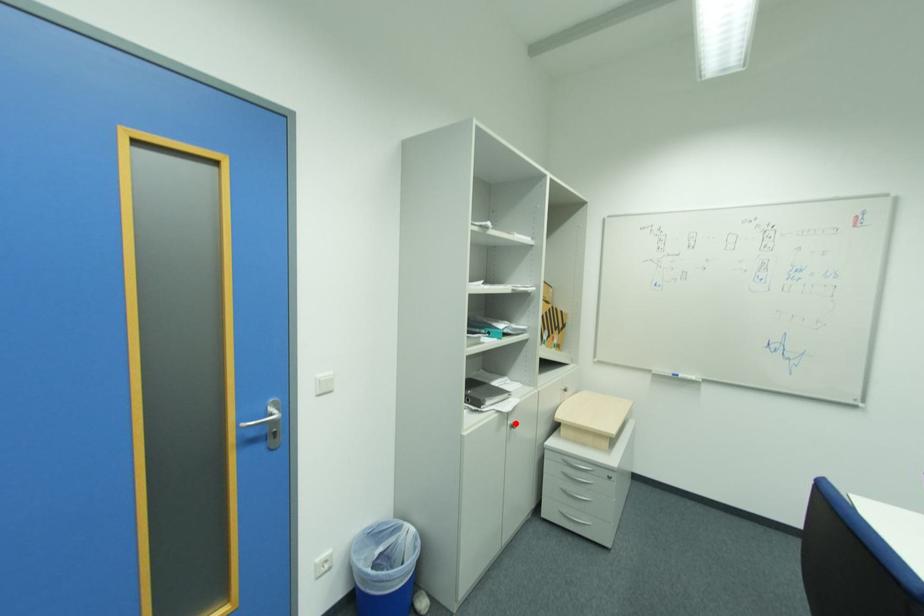
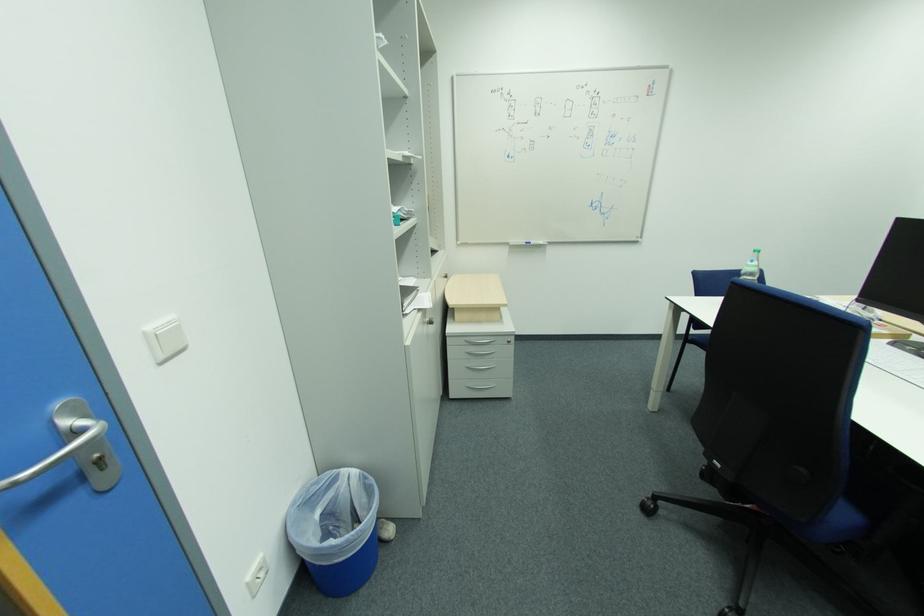
Locate, in the second image, the point that corresponds to the highlighted location in the first image.

(433, 321)